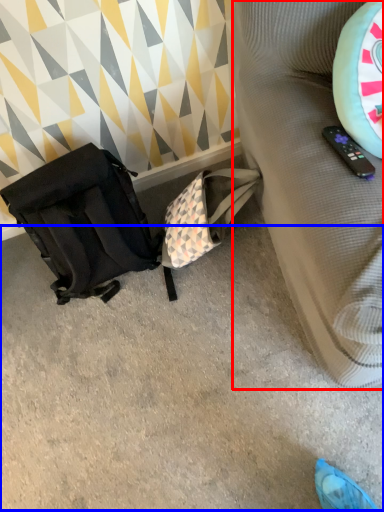
Question: Which of the following is the closest to the observer, furniture (highlighted by a red box) or concrete (highlighted by a blue box)?

Choices:
 (A) furniture
 (B) concrete

Answer: (A)